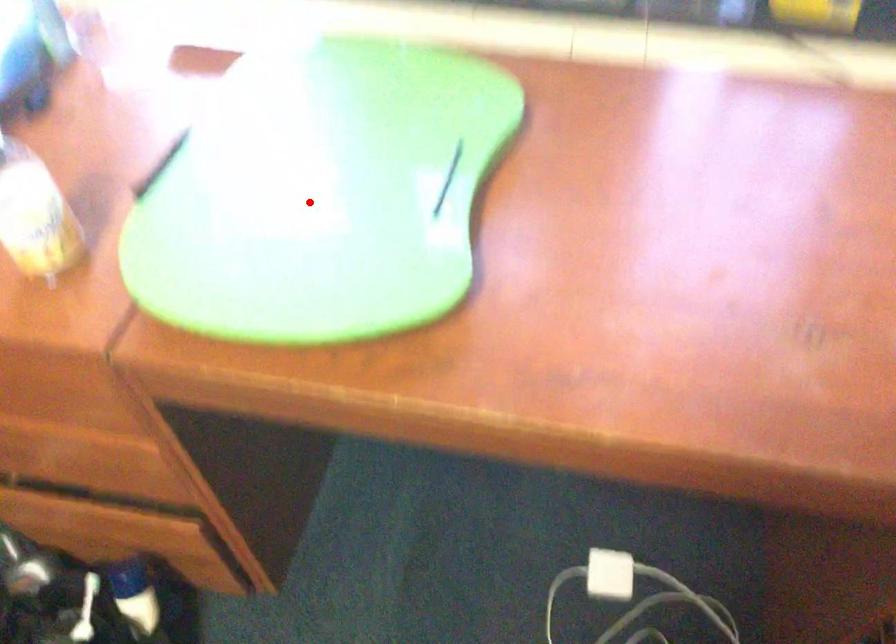
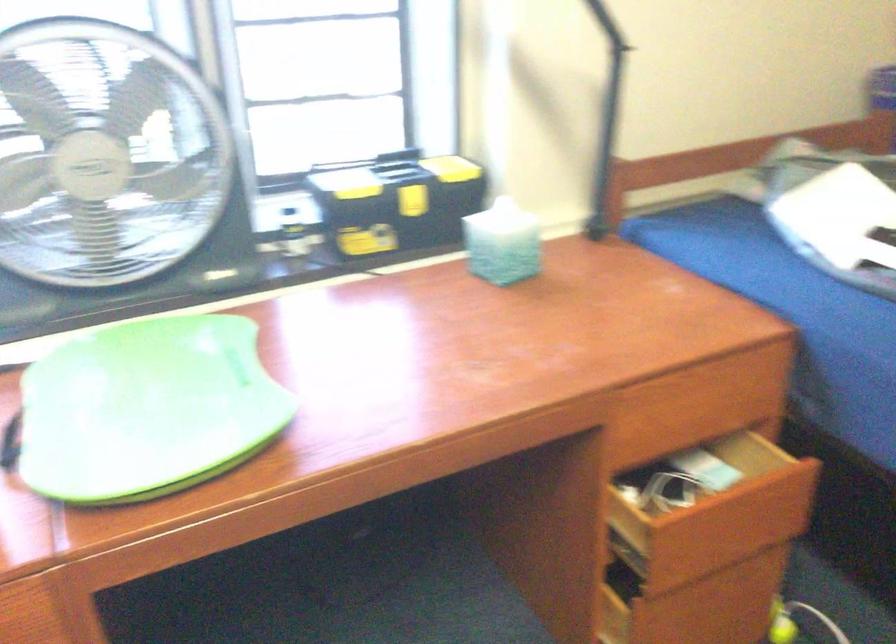
Question: I am providing you with two images of the same scene from different viewpoints. A red point is shown in image1. For the corresponding object point in image2, is it positioned nearer or farther from the camera?

Choices:
 (A) Nearer
 (B) Farther

Answer: (B)